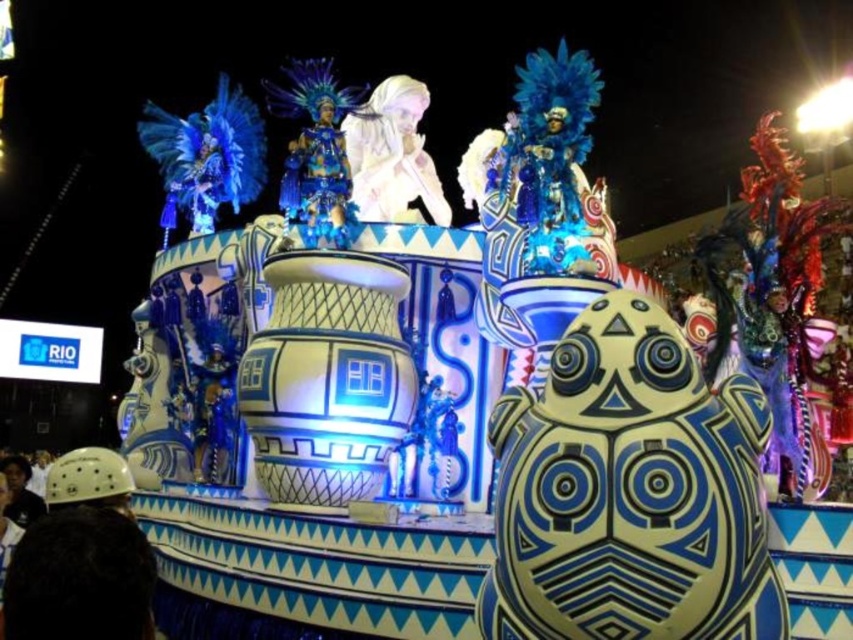
You are an event planner assessing the float for visibility. Which object has a larger width between the white matte hair at upper center and the shiny blue costume at center?

The white matte hair at upper center has a larger width than the shiny blue costume at center.

You are a photographer trying to capture the performers on the float. You notice the white matte hair at upper center and the shiny blue costume at center. Which of these two elements should you focus on if you want to highlight something that stands out due to its size?

The white matte hair at upper center has a larger size compared to the shiny blue costume at center, so focusing on the white matte hair at upper center would highlight its prominence in size.